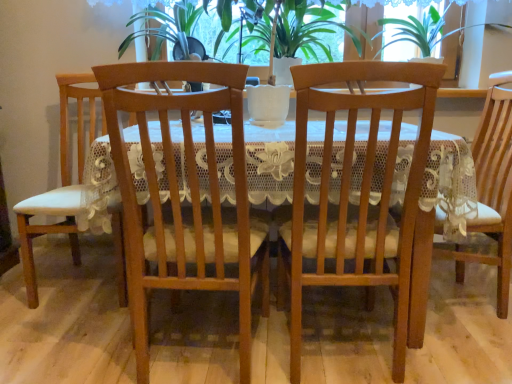
Locate an element on the screen. free space that is to the left of matte wood chair at center, which appears as the 3th chair when viewed from the right is located at coordinates (64, 346).